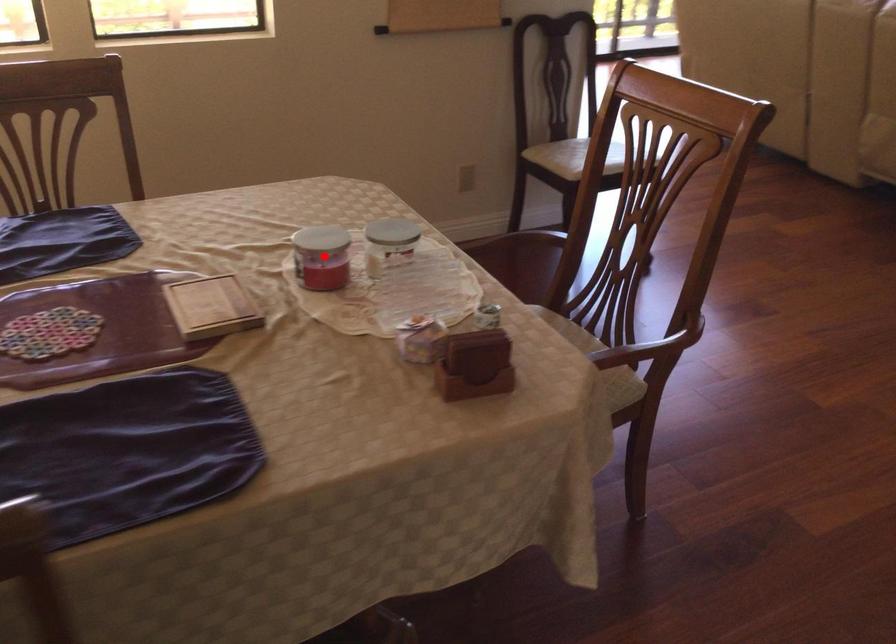
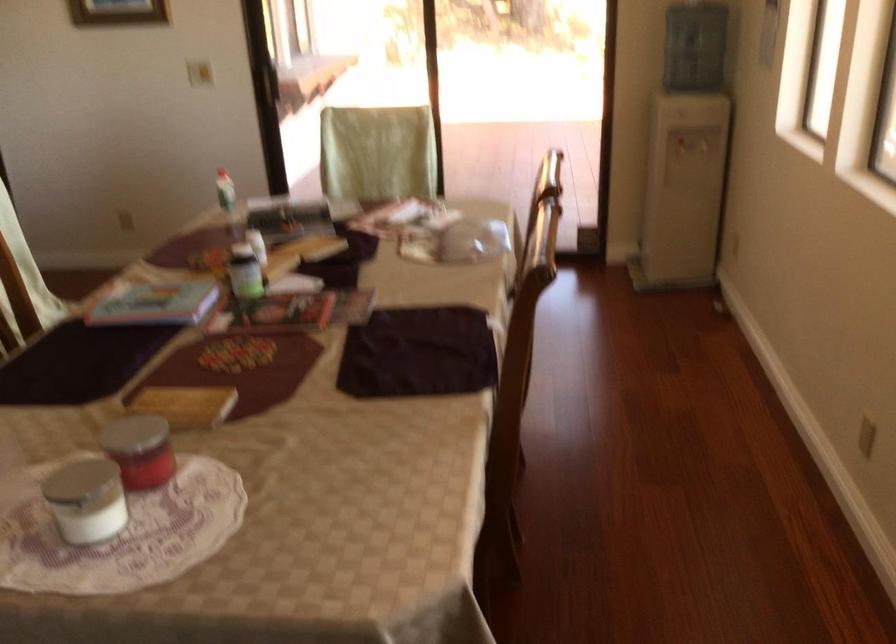
Question: I am providing you with two images of the same scene from different viewpoints. Given a red point in image1, look at the same physical point in image2. Is it:

Choices:
 (A) Closer to the viewpoint
 (B) Farther from the viewpoint

Answer: (A)